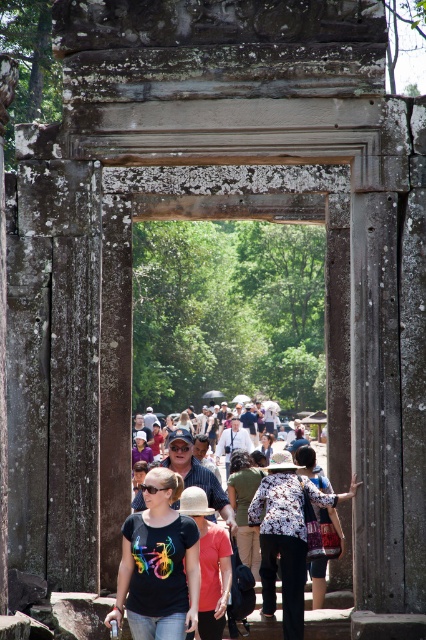
Question: Which object is positioned farthest from the floral-patterned fabric at center?

Choices:
 (A) beige woven hat at center
 (B) multicolored t-shirt at center
 (C) patterned fabric bag at center
 (D) black matte t-shirt at center

Answer: (A)

Question: Based on their relative distances, which object is nearer to the patterned fabric bag at center?

Choices:
 (A) black matte t-shirt at center
 (B) beige woven hat at center
 (C) multicolored t-shirt at center
 (D) floral-patterned fabric at center

Answer: (C)

Question: Is black matte t-shirt at center closer to camera compared to multicolored t-shirt at center?

Choices:
 (A) yes
 (B) no

Answer: (A)

Question: Which point appears farthest from the camera in this image?

Choices:
 (A) (218, 557)
 (B) (316, 484)
 (C) (328, 525)
 (D) (166, 545)

Answer: (B)

Question: Is black matte t-shirt at center thinner than multicolored t-shirt at center?

Choices:
 (A) yes
 (B) no

Answer: (A)

Question: Is beige woven hat at center thinner than multicolored t-shirt at center?

Choices:
 (A) no
 (B) yes

Answer: (B)